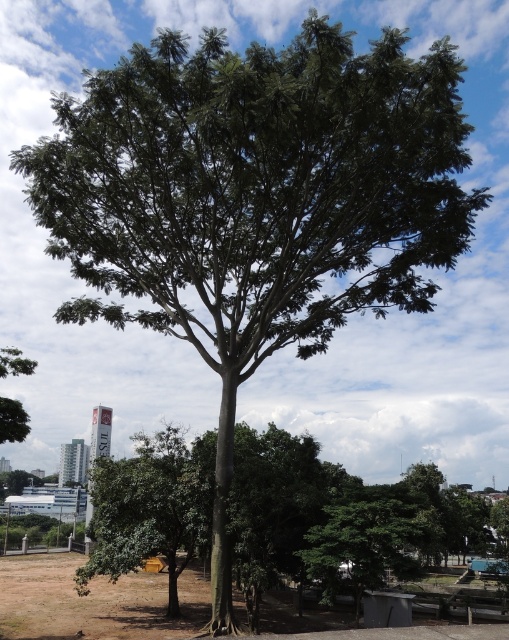
Question: Which point is closer to the camera taking this photo?

Choices:
 (A) (409, 536)
 (B) (2, 397)

Answer: (A)

Question: Can you confirm if green leafy tree at lower center is positioned above green leafy tree at left?

Choices:
 (A) no
 (B) yes

Answer: (A)

Question: Can you confirm if green leafy tree at lower center is positioned to the left of green leafy tree at left?

Choices:
 (A) yes
 (B) no

Answer: (B)

Question: Among these objects, which one is nearest to the camera?

Choices:
 (A) green leafy tree at left
 (B) green leafy tree at lower center

Answer: (A)

Question: Is green leafy tree at lower center closer to the viewer compared to green leafy tree at left?

Choices:
 (A) yes
 (B) no

Answer: (B)